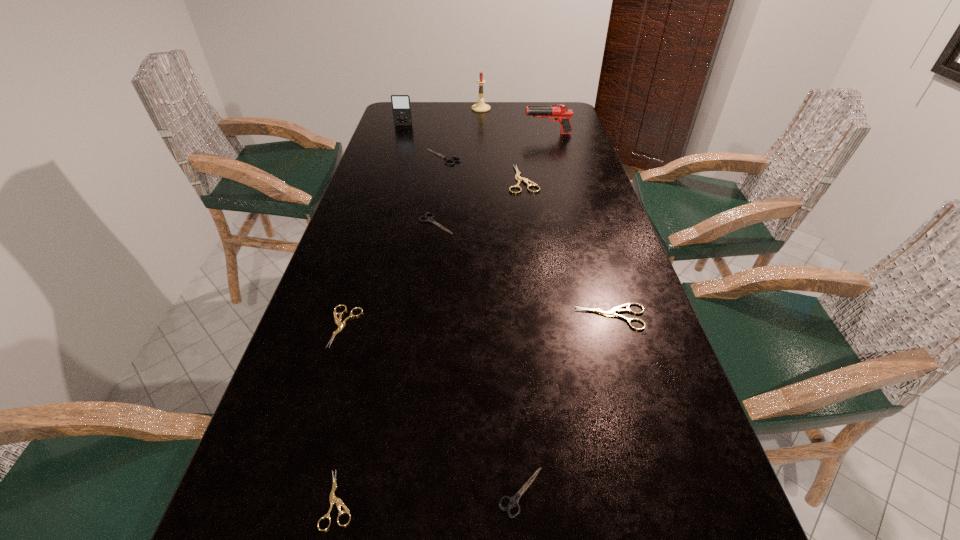
Find the location of `free location that satisfies the following two spatial constraints: 1. on the front-facing side of the leftmost beige shears; 2. on the left side of the ninth nearest object`. free location that satisfies the following two spatial constraints: 1. on the front-facing side of the leftmost beige shears; 2. on the left side of the ninth nearest object is located at coordinates (341, 326).

This screenshot has width=960, height=540. Find the location of `vacant space that satisfies the following two spatial constraints: 1. on the front-facing side of the second smallest beige shears; 2. on the left side of the iPod`. vacant space that satisfies the following two spatial constraints: 1. on the front-facing side of the second smallest beige shears; 2. on the left side of the iPod is located at coordinates (341, 326).

The image size is (960, 540). Find the location of `blank space that satisfies the following two spatial constraints: 1. at the aiming end of the rightmost beige shears; 2. on the right side of the eighth nearest object`. blank space that satisfies the following two spatial constraints: 1. at the aiming end of the rightmost beige shears; 2. on the right side of the eighth nearest object is located at coordinates (597, 317).

You are a GUI agent. You are given a task and a screenshot of the screen. Output one action in this format:
    pyautogui.click(x=<x>, y=<y>)
    Task: Click on the vacant area in the image that satisfies the following two spatial constraints: 1. on the front-facing side of the second biggest beige shears; 2. on the left side of the ninth nearest object
    
    Given the screenshot: What is the action you would take?
    pyautogui.click(x=344, y=317)